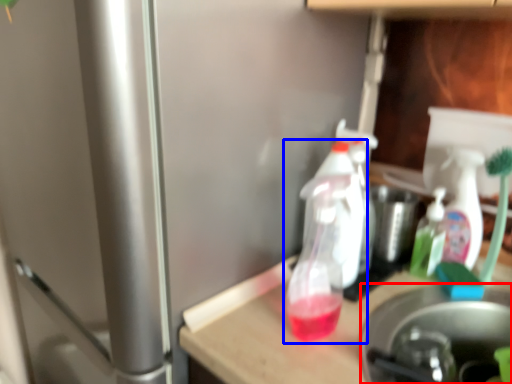
Question: Which of the following is the farthest to the observer, appliance (highlighted by a red box) or bottle (highlighted by a blue box)?

Choices:
 (A) appliance
 (B) bottle

Answer: (B)